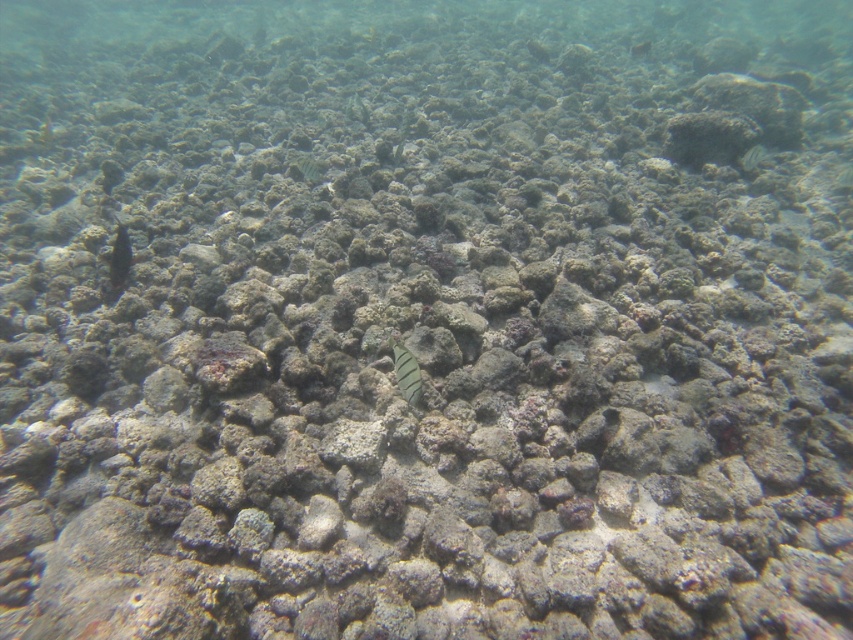
Question: In this image, where is shiny black fish at center located relative to speckled green fish at upper right?

Choices:
 (A) left
 (B) right

Answer: (A)

Question: Estimate the real-world distances between objects in this image. Which object is farther from the gray striped fish at center?

Choices:
 (A) speckled green fish at upper right
 (B) shiny black fish at center

Answer: (A)

Question: Does shiny black fish at center appear under speckled green fish at upper right?

Choices:
 (A) no
 (B) yes

Answer: (B)

Question: Among these objects, which one is nearest to the camera?

Choices:
 (A) gray striped fish at center
 (B) shiny black fish at center
 (C) speckled green fish at upper right

Answer: (A)

Question: Is the position of gray striped fish at center less distant than that of speckled green fish at upper right?

Choices:
 (A) no
 (B) yes

Answer: (B)

Question: Which object is closer to the camera taking this photo?

Choices:
 (A) speckled green fish at upper right
 (B) shiny black fish at center

Answer: (B)